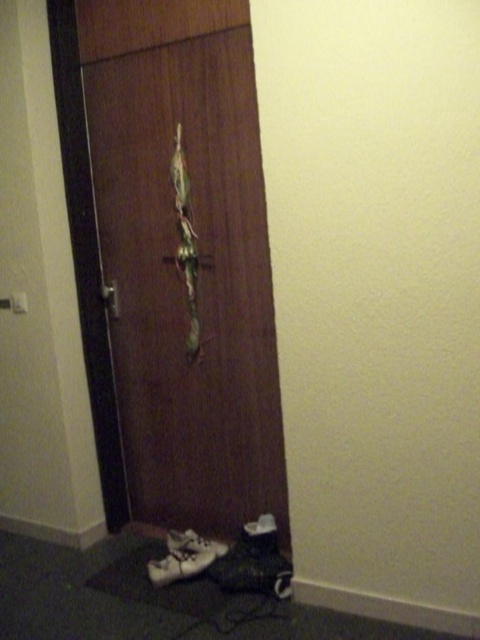
Question: In this image, where is wooden door at center located relative to white leather shoe at lower left?

Choices:
 (A) left
 (B) right

Answer: (A)

Question: Which point is farther to the camera?

Choices:
 (A) wooden door at center
 (B) white matte shoe at lower left

Answer: (B)

Question: Among these points, which one is farthest from the camera?

Choices:
 (A) (217, 442)
 (B) (195, 538)

Answer: (A)

Question: Does wooden door at center have a larger size compared to white matte shoe at lower left?

Choices:
 (A) yes
 (B) no

Answer: (A)

Question: Which of these objects is positioned closest to the wooden door at center?

Choices:
 (A) white matte shoe at lower left
 (B) white leather shoe at lower left

Answer: (B)

Question: Is wooden door at center to the right of white matte shoe at lower left from the viewer's perspective?

Choices:
 (A) yes
 (B) no

Answer: (B)